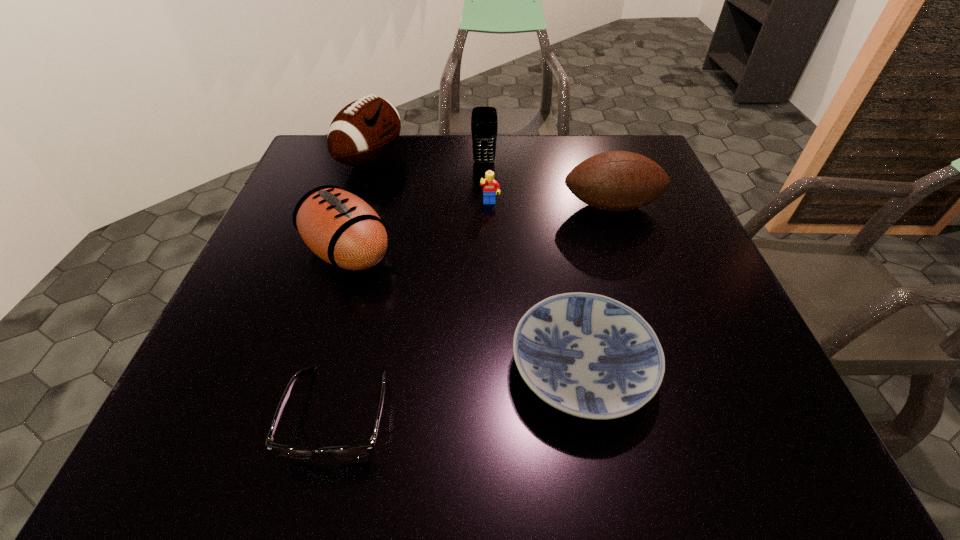
At what (x,y) coordinates should I click in order to perform the action: click on vacant space situated 0.320m on the back of the plate. Please return your answer as a coordinate pair (x, y). Looking at the image, I should click on [x=553, y=212].

The height and width of the screenshot is (540, 960). Find the location of `football (American) at the far edge`. football (American) at the far edge is located at coordinates (364, 131).

Find the location of a particular element. This screenshot has width=960, height=540. cellular telephone located in the far edge section of the desktop is located at coordinates (484, 123).

I want to click on plate present at the near edge, so click(588, 355).

Identify the location of spectacles at the near edge. Image resolution: width=960 pixels, height=540 pixels. (354, 451).

At what (x,y) coordinates should I click in order to perform the action: click on object at the right edge. Please return your answer as a coordinate pair (x, y). Looking at the image, I should click on (617, 181).

At what (x,y) coordinates should I click in order to perform the action: click on object that is positioned at the far left corner. Please return your answer as a coordinate pair (x, y). Looking at the image, I should click on (364, 131).

Locate an element on the screen. free region at the far edge of the desktop is located at coordinates (511, 140).

Where is `free space at the near edge`? The width and height of the screenshot is (960, 540). free space at the near edge is located at coordinates (642, 416).

In order to click on vacant area at the right edge of the desktop in this screenshot , I will do pyautogui.click(x=675, y=278).